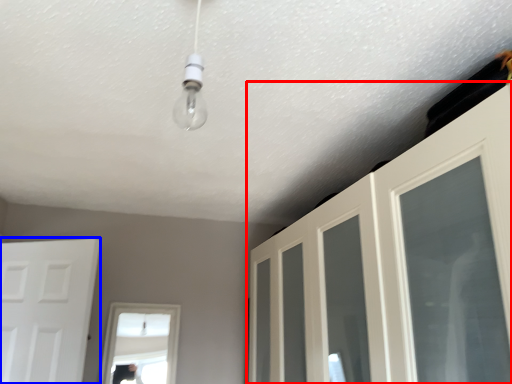
Question: Which object appears closest to the camera in this image, door (highlighted by a red box) or door (highlighted by a blue box)?

Choices:
 (A) door
 (B) door

Answer: (A)